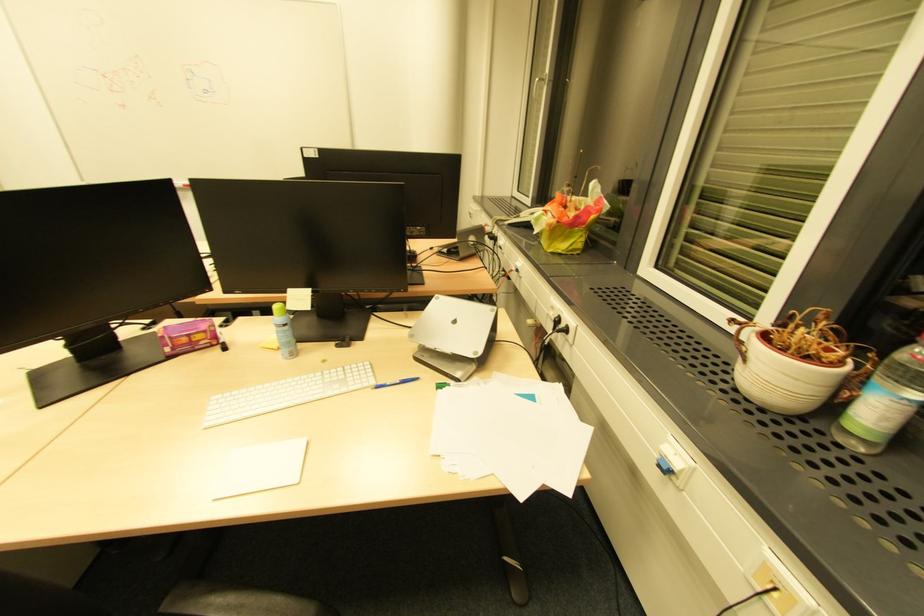
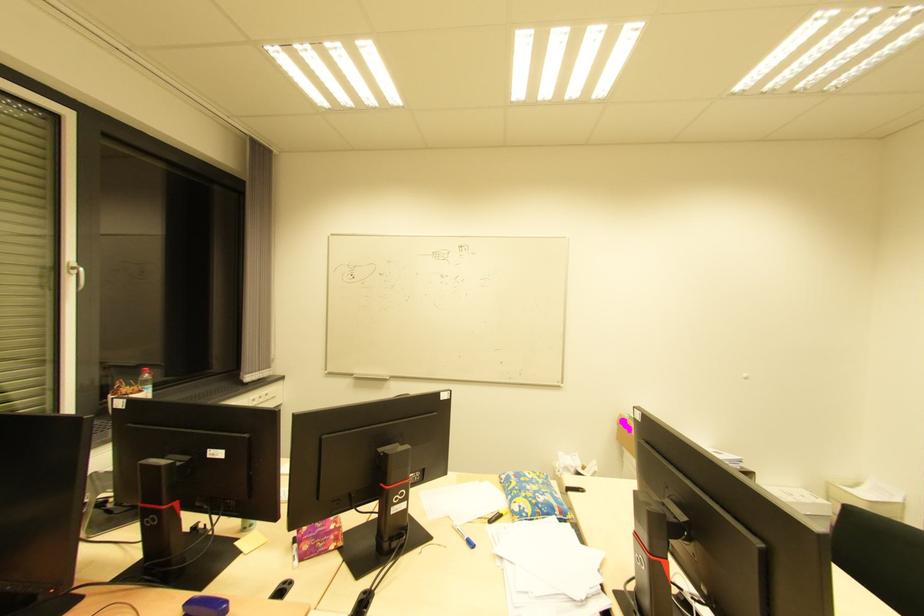
Question: I am providing you with two images of the same scene from different viewpoints. Please identify which objects are invisible in image2.

Choices:
 (A) purple tissue box
 (B) white window handle
 (C) patterned cylindrical cup
 (D) blue pen

Answer: (D)